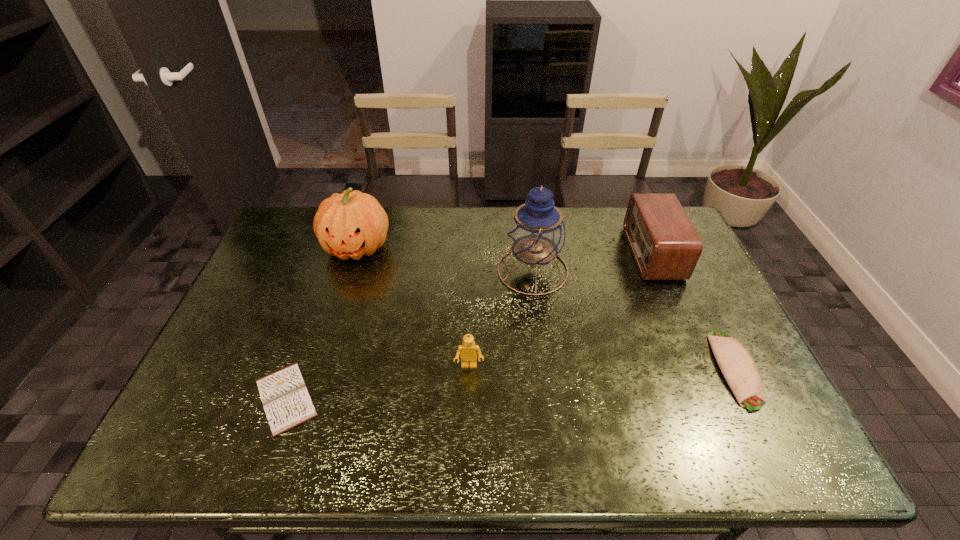
This screenshot has height=540, width=960. What are the coordinates of `free space between the lantern and the shortest object` in the screenshot? It's located at (409, 334).

The height and width of the screenshot is (540, 960). What are the coordinates of `object that can be found as the second closest to the radio receiver` in the screenshot? It's located at (536, 234).

Locate an element on the screen. Image resolution: width=960 pixels, height=540 pixels. object that is the fifth closest to the pumpkin is located at coordinates (739, 369).

You are a GUI agent. You are given a task and a screenshot of the screen. Output one action in this format:
    pyautogui.click(x=<x>, y=<y>)
    Task: Click on the vacant region that satisfies the following two spatial constraints: 1. on the front-facing side of the lantern; 2. on the face of the third shortest object
    The width and height of the screenshot is (960, 540).
    Given the screenshot: What is the action you would take?
    pyautogui.click(x=544, y=366)